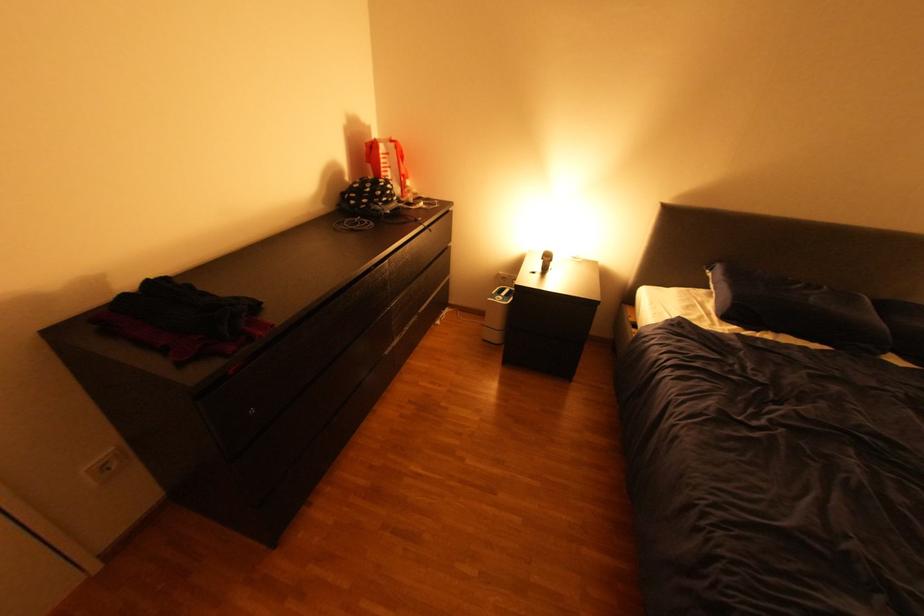
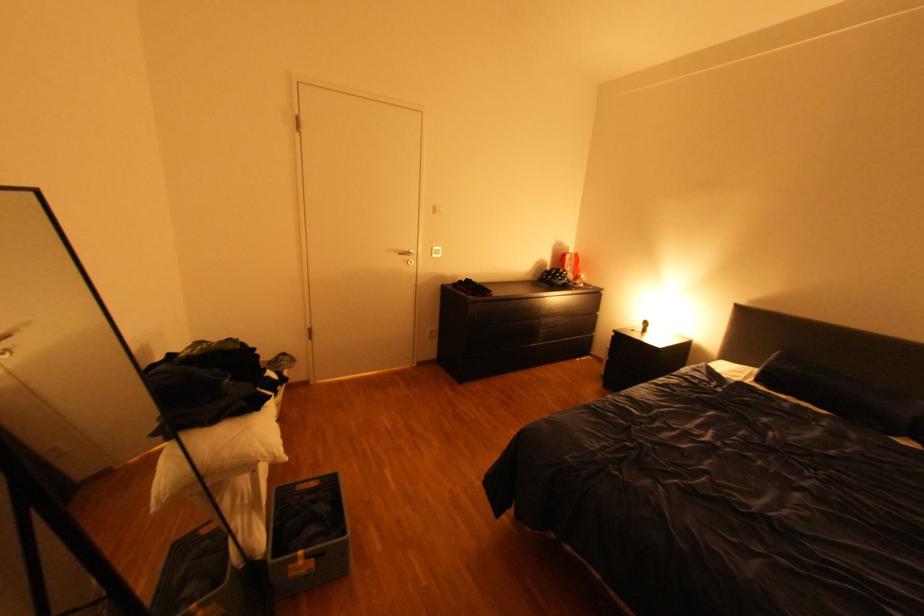
In the second image, find the point that corresponds to point (561, 262) in the first image.

(659, 328)